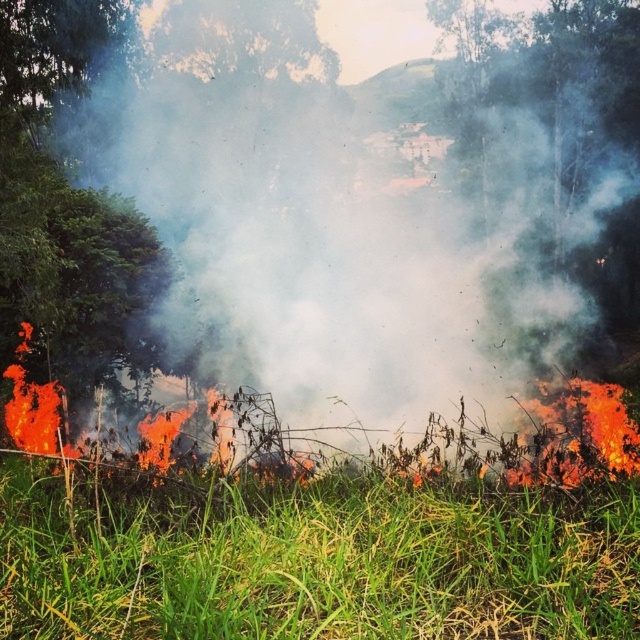
Question: In this image, where is white smoke at center located relative to green grass at lower center?

Choices:
 (A) right
 (B) left

Answer: (A)

Question: Does white smoke at center appear under green grass at lower center?

Choices:
 (A) no
 (B) yes

Answer: (A)

Question: Which of the following is the closest to the observer?

Choices:
 (A) (570, 602)
 (B) (570, 211)

Answer: (A)

Question: Is white smoke at center wider than green grass at lower center?

Choices:
 (A) yes
 (B) no

Answer: (A)